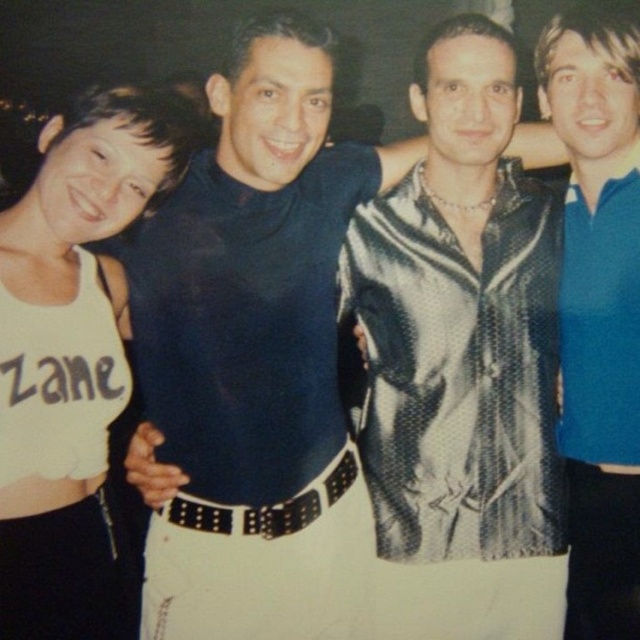
Question: Which object is positioned farthest from the matte black turtleneck at center?

Choices:
 (A) blue smooth polo shirt at right
 (B) shiny metallic jacket at center

Answer: (A)

Question: Does matte black turtleneck at center have a larger size compared to black leather belt at center?

Choices:
 (A) no
 (B) yes

Answer: (B)

Question: Which object appears closest to the camera in this image?

Choices:
 (A) black leather belt at center
 (B) matte black turtleneck at center

Answer: (B)

Question: Which point is farther from the camera taking this photo?

Choices:
 (A) (604, 22)
 (B) (307, 499)
 (C) (477, 438)
 (D) (180, 516)

Answer: (A)

Question: Does matte black turtleneck at center appear under blue smooth polo shirt at right?

Choices:
 (A) no
 (B) yes

Answer: (A)

Question: Can you confirm if blue smooth polo shirt at right is wider than black leather belt at center?

Choices:
 (A) yes
 (B) no

Answer: (B)